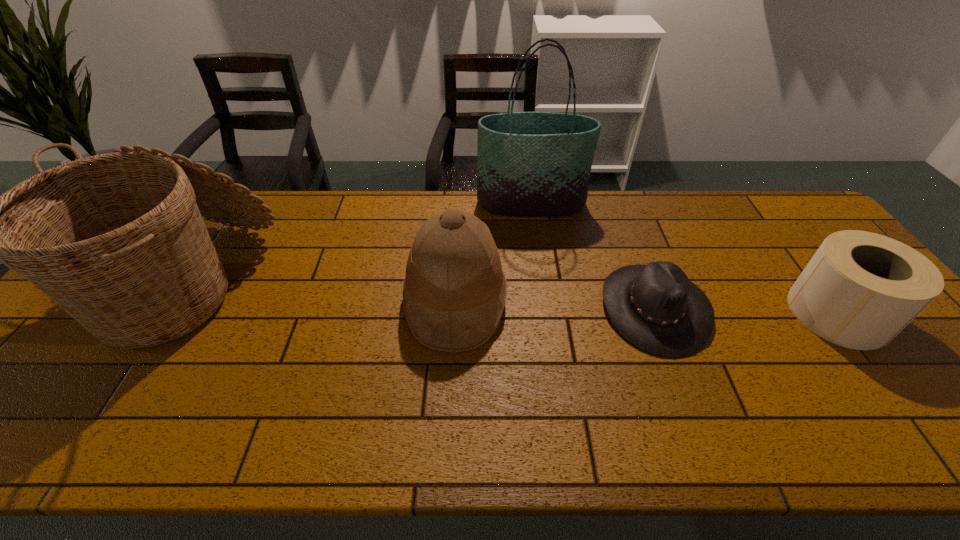
The height and width of the screenshot is (540, 960). Identify the location of vacant point located between the tote bag and the rightmost object. (684, 259).

Find the location of a particular element. The height and width of the screenshot is (540, 960). blank region between the tallest object and the fourth tallest object is located at coordinates (684, 259).

This screenshot has height=540, width=960. Find the location of `object identified as the closest to the third shortest object`. object identified as the closest to the third shortest object is located at coordinates (533, 164).

Locate which object ranks fourth in proximity to the basket. Please provide its 2D coordinates. Your answer should be formatted as a tuple, i.e. [(x, y)], where the tuple contains the x and y coordinates of a point satisfying the conditions above.

[(860, 289)]

Find the location of a particular element. This screenshot has width=960, height=540. vacant space that satisfies the following two spatial constraints: 1. on the back side of the tote bag; 2. on the right side of the basket is located at coordinates (240, 204).

This screenshot has height=540, width=960. Find the location of `free spot that satisfies the following two spatial constraints: 1. on the front-facing side of the toilet tissue; 2. on the left side of the shorter hat`. free spot that satisfies the following two spatial constraints: 1. on the front-facing side of the toilet tissue; 2. on the left side of the shorter hat is located at coordinates (657, 313).

The height and width of the screenshot is (540, 960). What are the coordinates of `vacant position in the image that satisfies the following two spatial constraints: 1. on the front-facing side of the toilet tissue; 2. on the right side of the shortest object` in the screenshot? It's located at (657, 313).